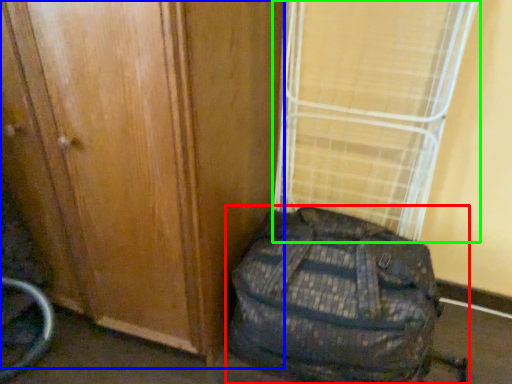
Question: Which object is positioned closest to backpack (highlighted by a red box)? Select from door (highlighted by a blue box) and curtain (highlighted by a green box).

Choices:
 (A) door
 (B) curtain

Answer: (A)